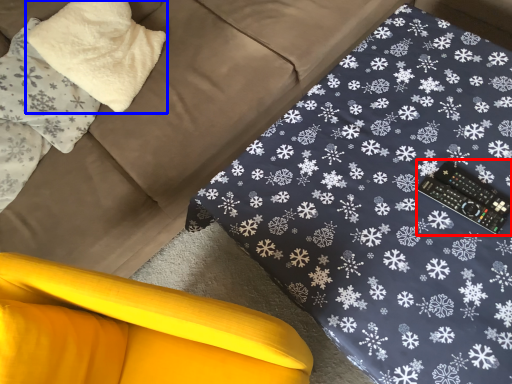
Question: Which point is further to the camera, control (highlighted by a red box) or pillow (highlighted by a blue box)?

Choices:
 (A) control
 (B) pillow

Answer: (B)